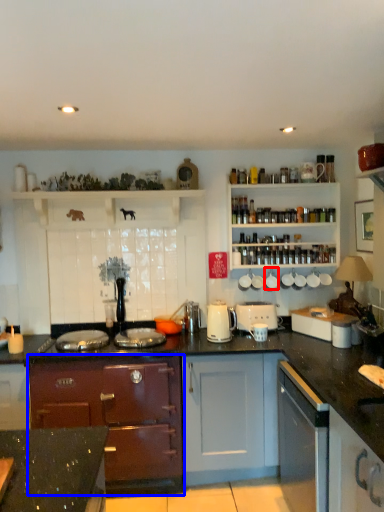
Question: Which point is further to the camera, appliance (highlighted by a red box) or cabinetry (highlighted by a blue box)?

Choices:
 (A) appliance
 (B) cabinetry

Answer: (A)